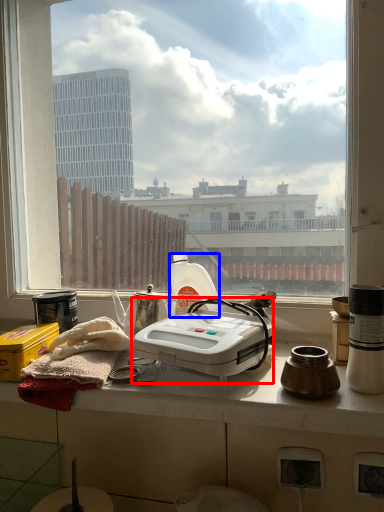
Question: Which object is further to the camera taking this photo, kitchen appliance (highlighted by a red box) or bottle (highlighted by a blue box)?

Choices:
 (A) kitchen appliance
 (B) bottle

Answer: (B)